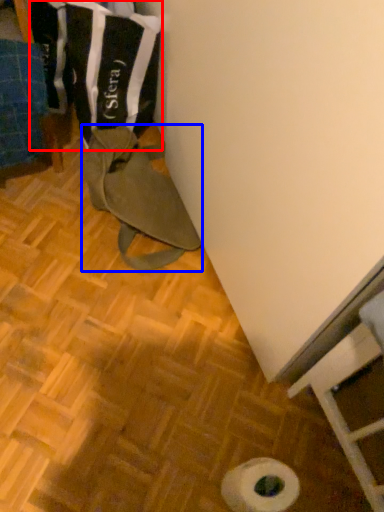
Question: Which point is closer to the camera, laundry (highlighted by a red box) or wide (highlighted by a blue box)?

Choices:
 (A) laundry
 (B) wide

Answer: (A)